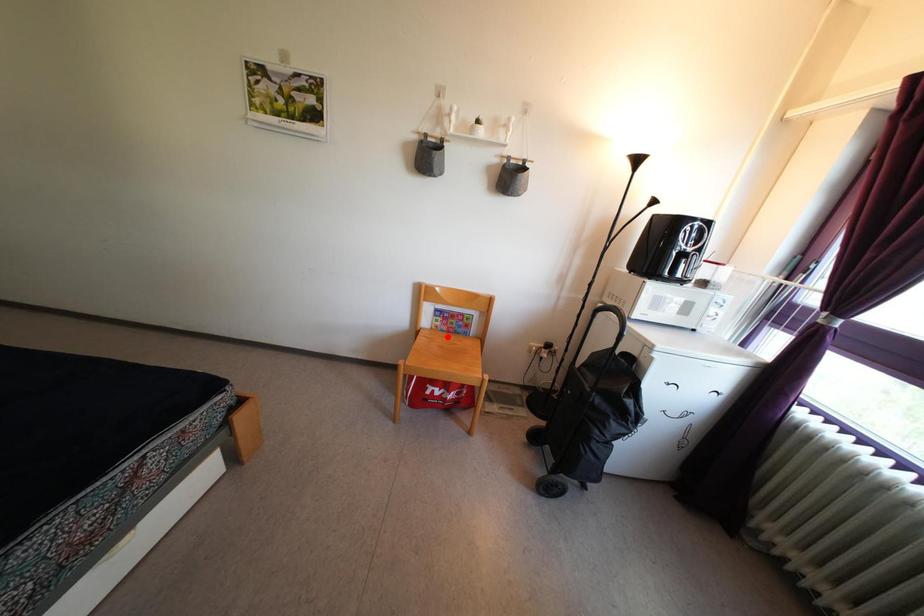
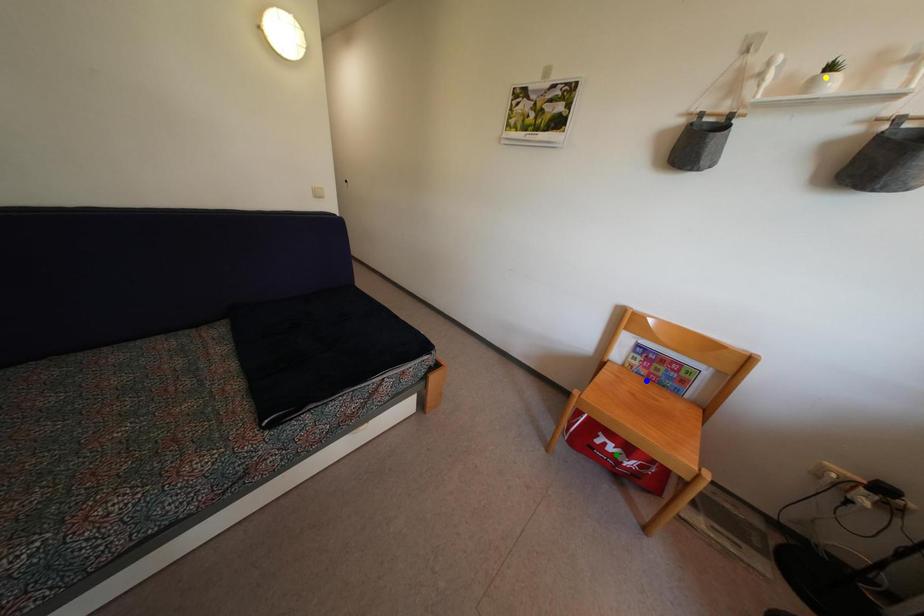
Question: I am providing you with two images of the same scene from different viewpoints. A red point is marked on the first image. You are given multiple points on the second image. Can you choose the point in image 2 that corresponds to the point in image 1?

Choices:
 (A) green point
 (B) yellow point
 (C) blue point

Answer: (C)